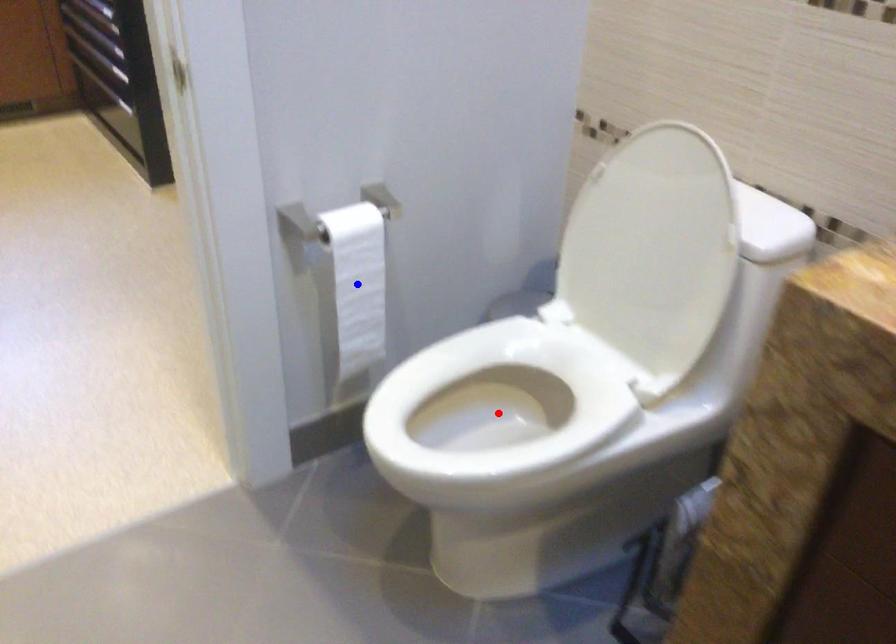
Question: Which of the two points in the image is closer to the camera?

Choices:
 (A) Blue point is closer.
 (B) Red point is closer.

Answer: (A)